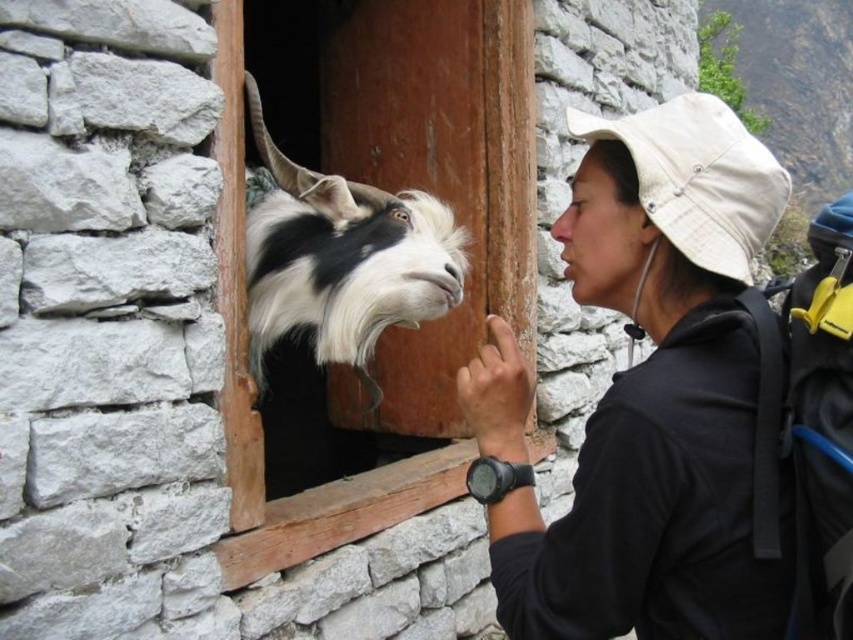
Which is more to the right, black matte hat at upper right or pink smooth skin at center?

Positioned to the right is black matte hat at upper right.

Is black matte hat at upper right closer to camera compared to pink smooth skin at center?

That is True.

What do you see at coordinates (645, 396) in the screenshot? I see `black matte hat at upper right` at bounding box center [645, 396].

At what (x,y) coordinates should I click in order to perform the action: click on black matte hat at upper right. Please return your answer as a coordinate pair (x, y). The height and width of the screenshot is (640, 853). Looking at the image, I should click on (645, 396).

Can you confirm if wooden door at center is positioned above pink smooth skin at center?

Actually, wooden door at center is below pink smooth skin at center.

Does wooden door at center have a greater height compared to pink smooth skin at center?

Yes, wooden door at center is taller than pink smooth skin at center.

Is point (415, 428) farther from viewer compared to point (567, 237)?

Yes, point (415, 428) is farther from viewer.

This screenshot has width=853, height=640. What are the coordinates of `wooden door at center` in the screenshot? It's located at (393, 189).

How distant is black matte hat at upper right from black and white fur at window center?

black matte hat at upper right and black and white fur at window center are 1.07 meters apart from each other.

Does black matte hat at upper right appear under black and white fur at window center?

Indeed, black matte hat at upper right is positioned under black and white fur at window center.

The image size is (853, 640). Describe the element at coordinates (645, 396) in the screenshot. I see `black matte hat at upper right` at that location.

In order to click on black matte hat at upper right in this screenshot , I will do `click(645, 396)`.